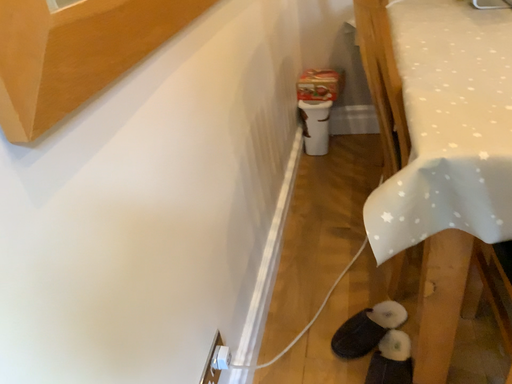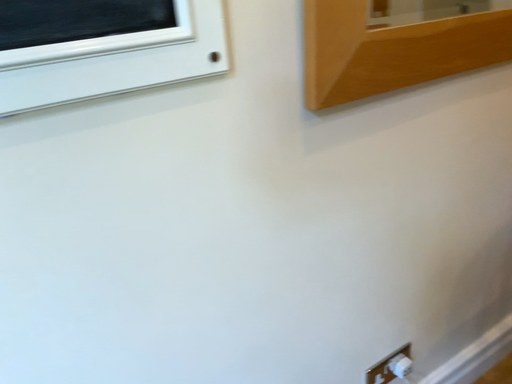
Question: Which way did the camera rotate in the video?

Choices:
 (A) rotated downward
 (B) rotated upward

Answer: (B)